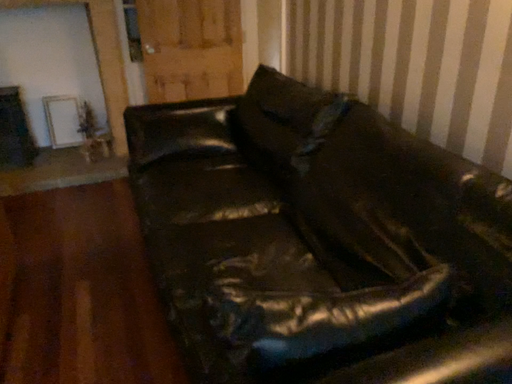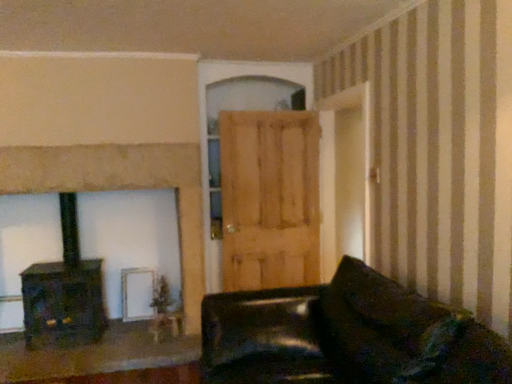
Question: Which way did the camera rotate in the video?

Choices:
 (A) rotated right
 (B) rotated left

Answer: (B)